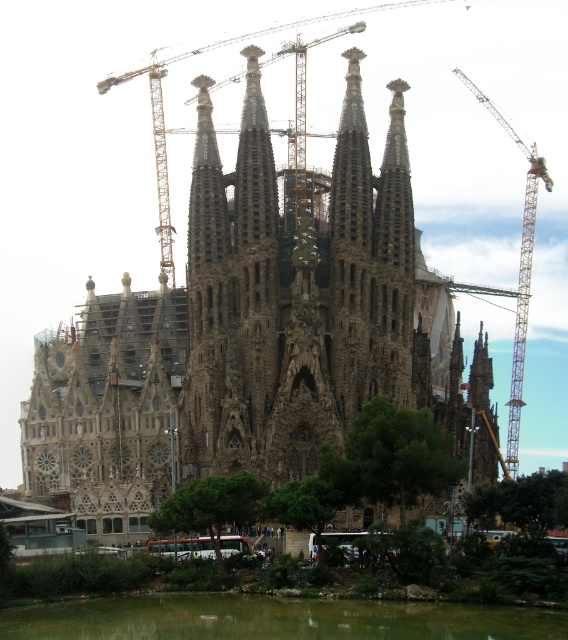
Question: Among these points, which one is farthest from the camera?

Choices:
 (A) (227, 38)
 (B) (427, 618)
 (C) (457, 326)

Answer: (A)

Question: Which of the following is the closest to the observer?

Choices:
 (A) brown stone church at center
 (B) green liquid water at lower center

Answer: (B)

Question: From the image, what is the correct spatial relationship of green liquid water at lower center in relation to metallic construction crane at upper center?

Choices:
 (A) below
 (B) above

Answer: (A)

Question: Does yellow metallic crane at upper right come in front of metallic construction crane at upper center?

Choices:
 (A) no
 (B) yes

Answer: (A)

Question: Based on their relative distances, which object is nearer to the brown stone church at center?

Choices:
 (A) yellow metallic crane at upper right
 (B) green liquid water at lower center
 (C) metallic construction crane at upper center

Answer: (C)

Question: Considering the relative positions of brown stone church at center and green liquid water at lower center in the image provided, where is brown stone church at center located with respect to green liquid water at lower center?

Choices:
 (A) below
 (B) above

Answer: (B)